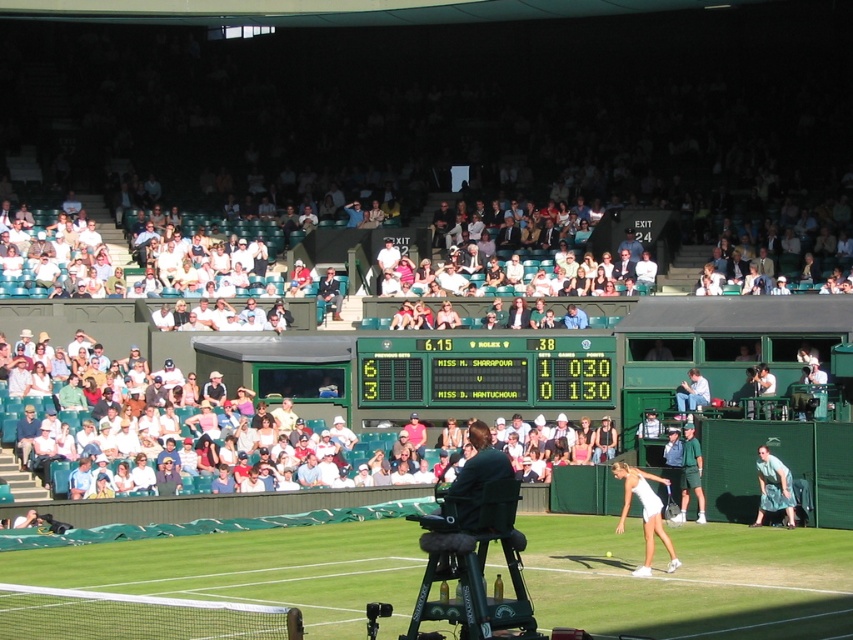
Between green grass tennis court at center and green fabric dress at lower right, which one is positioned higher?

Positioned higher is green fabric dress at lower right.

Which is in front, point (334, 624) or point (766, 454)?

Point (334, 624) is in front.

Who is more distant from viewer, (x=685, y=561) or (x=778, y=502)?

Point (x=778, y=502)

Where is `green grass tennis court at center`? This screenshot has width=853, height=640. green grass tennis court at center is located at coordinates (689, 579).

Does green plastic scoreboard at center come in front of green fabric dress at lower right?

No, green plastic scoreboard at center is further to the viewer.

Based on the photo, can you confirm if green plastic scoreboard at center is positioned to the left of green fabric dress at lower right?

Correct, you'll find green plastic scoreboard at center to the left of green fabric dress at lower right.

The image size is (853, 640). What are the coordinates of `green plastic scoreboard at center` in the screenshot? It's located at (485, 371).

Is green grass tennis court at center below white matte tennis racket at lower right?

Indeed, green grass tennis court at center is positioned under white matte tennis racket at lower right.

Which of these two, green grass tennis court at center or white matte tennis racket at lower right, stands taller?

Standing taller between the two is white matte tennis racket at lower right.

Identify the location of green grass tennis court at center. This screenshot has width=853, height=640. (689, 579).

At what (x,y) coordinates should I click in order to perform the action: click on green grass tennis court at center. Please return your answer as a coordinate pair (x, y). Looking at the image, I should click on (689, 579).